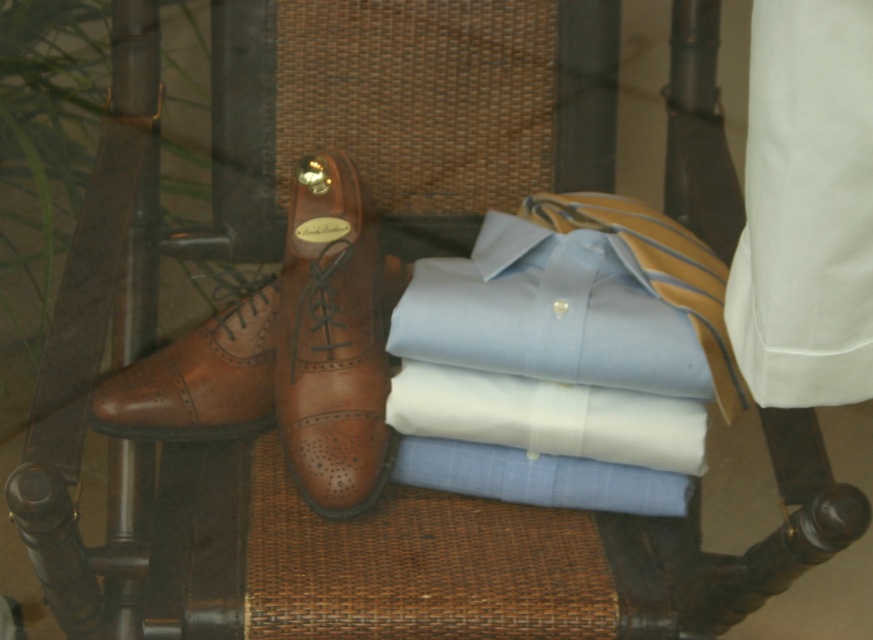
Question: Observing the image, what is the correct spatial positioning of light blue cotton shirt at center in reference to white cotton shirt at center?

Choices:
 (A) below
 (B) above

Answer: (B)

Question: Which point is farther to the camera?

Choices:
 (A) light blue cotton shirt at center
 (B) white cotton shirt at center
 (C) brown leather shoe at center

Answer: (C)

Question: Among these points, which one is nearest to the camera?

Choices:
 (A) (301, 294)
 (B) (702, 458)

Answer: (B)

Question: Is brown leather shoe at center further to the viewer compared to white cotton shirt at center?

Choices:
 (A) no
 (B) yes

Answer: (B)

Question: Based on their relative distances, which object is nearer to the light blue cotton shirt at center?

Choices:
 (A) brown leather shoe at center
 (B) white cotton shirt at center

Answer: (B)

Question: Is light blue cotton shirt at center bigger than brown leather shoe at center?

Choices:
 (A) no
 (B) yes

Answer: (B)